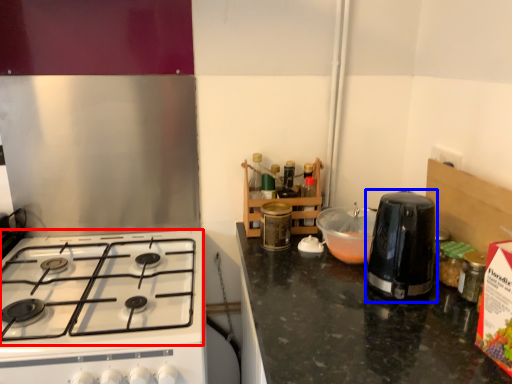
Question: Which object appears closest to the camera in this image, gas stove (highlighted by a red box) or kitchen appliance (highlighted by a blue box)?

Choices:
 (A) gas stove
 (B) kitchen appliance

Answer: (A)